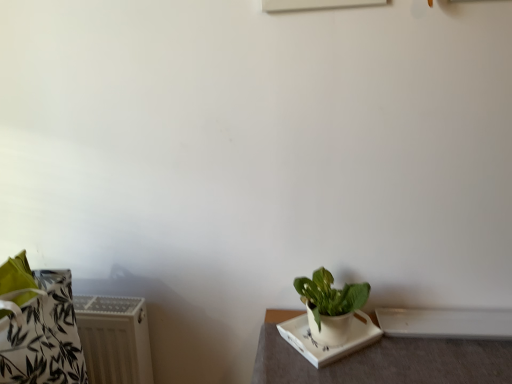
Locate an element on the screen. The image size is (512, 384). vacant area on top of white ceramic plate at lower right (from a real-world perspective) is located at coordinates (340, 327).